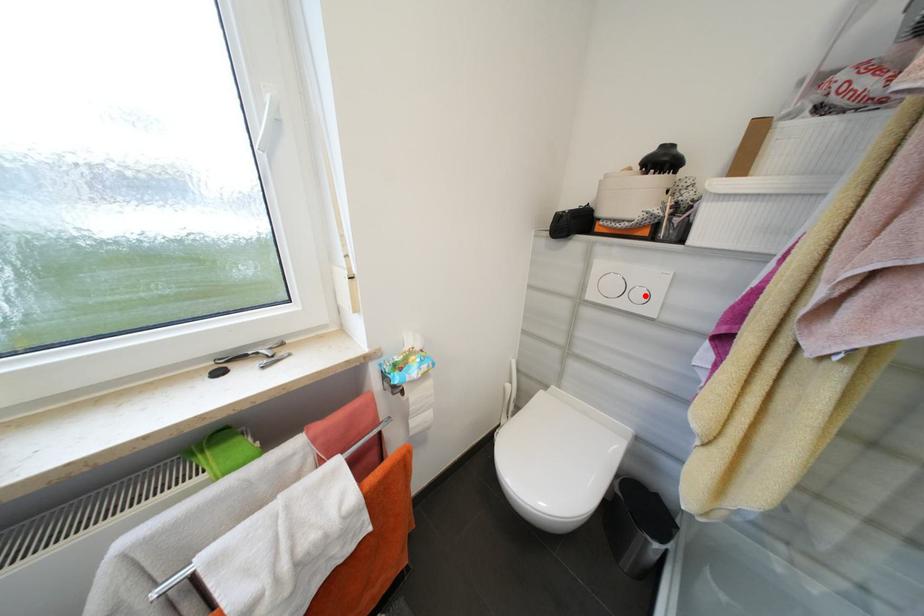
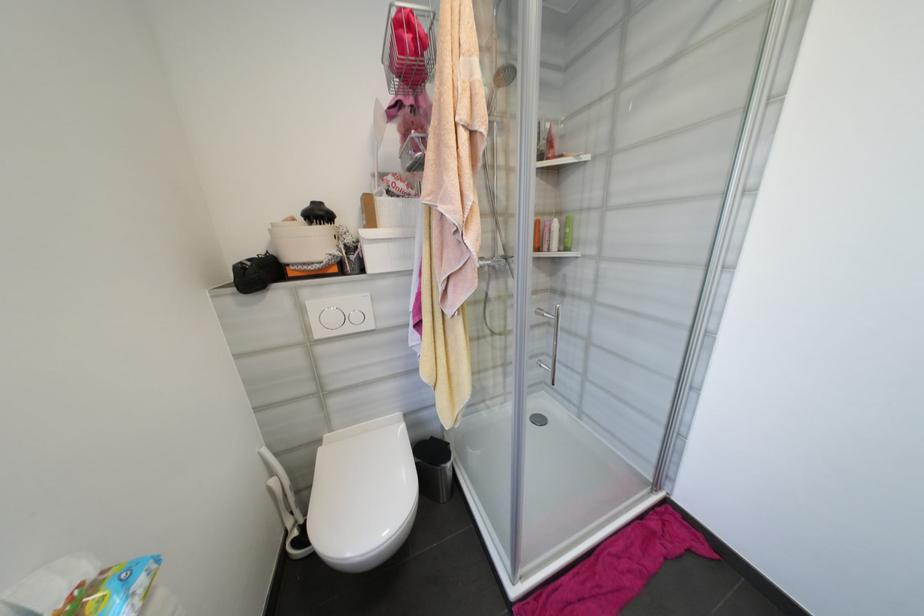
The point at the highlighted location is marked in the first image. Where is the corresponding point in the second image?

(361, 318)